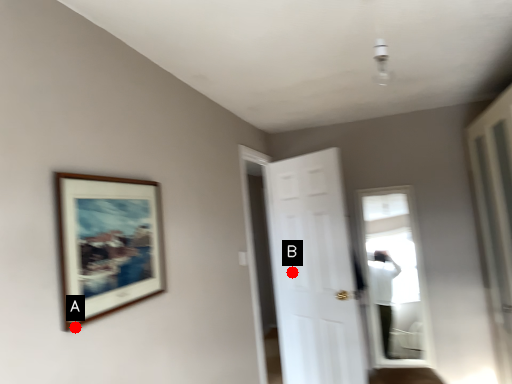
Question: Two points are circled on the image, labeled by A and B beside each circle. Which of the following is the farthest from the observer?

Choices:
 (A) A is further
 (B) B is further

Answer: (B)